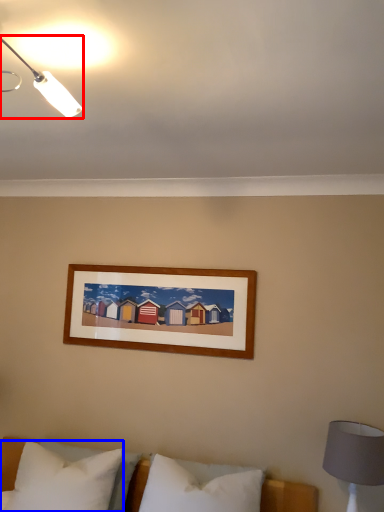
Question: Which object is further to the camera taking this photo, lamp (highlighted by a red box) or pillow (highlighted by a blue box)?

Choices:
 (A) lamp
 (B) pillow

Answer: (B)